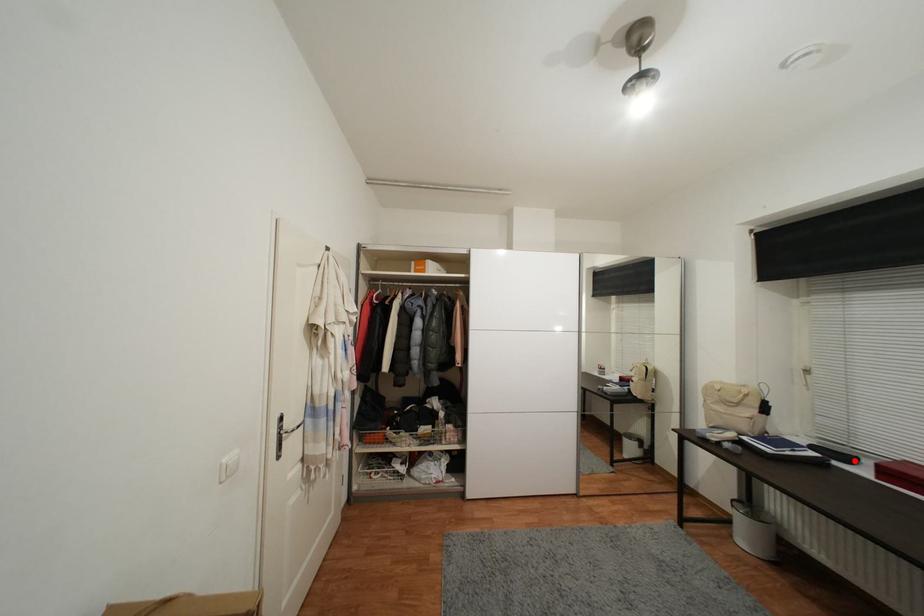
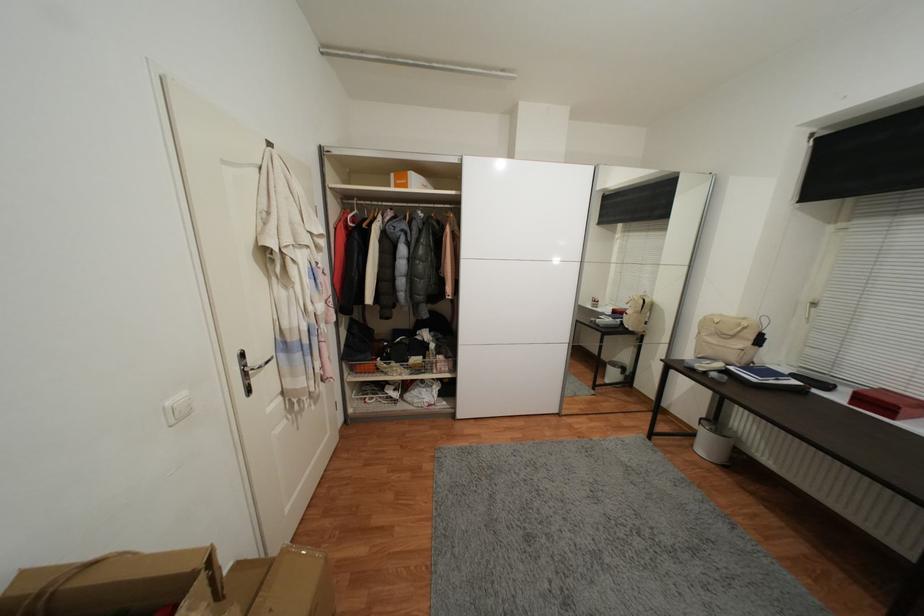
Question: I am providing you with two images of the same scene from different viewpoints. In image1, a red point is highlighted. Considering the same 3D point in image2, which of the following is correct?

Choices:
 (A) It is closer
 (B) It is farther

Answer: (B)